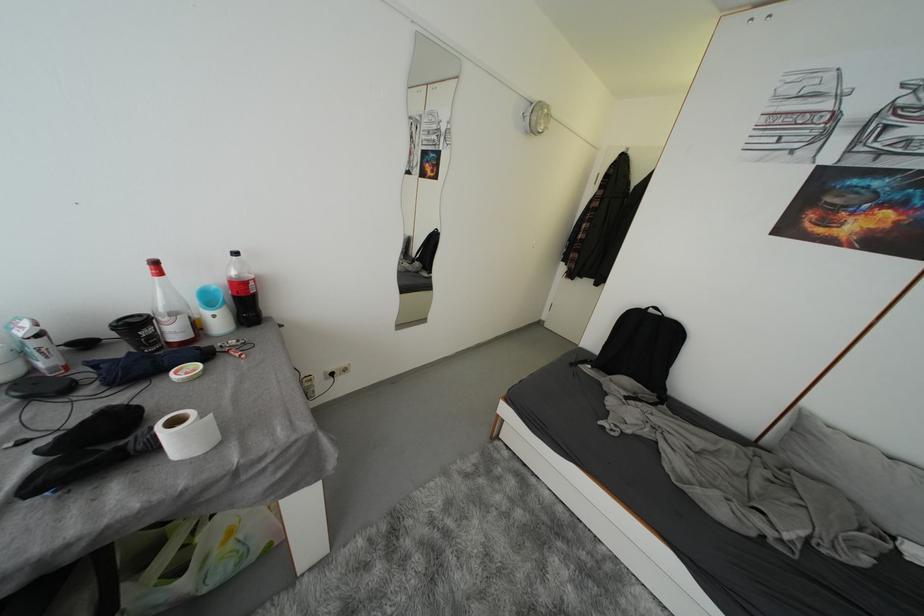
Where would you lift the toilet paper roll? Please return your answer as a coordinate pair (x, y).

(187, 434)